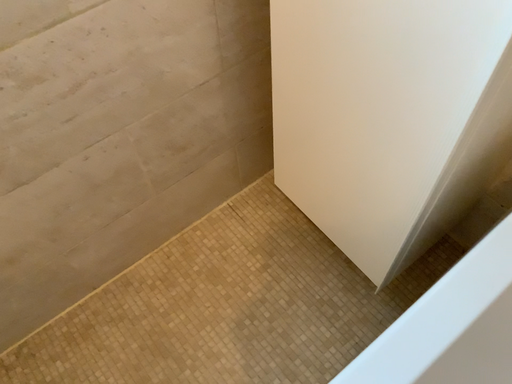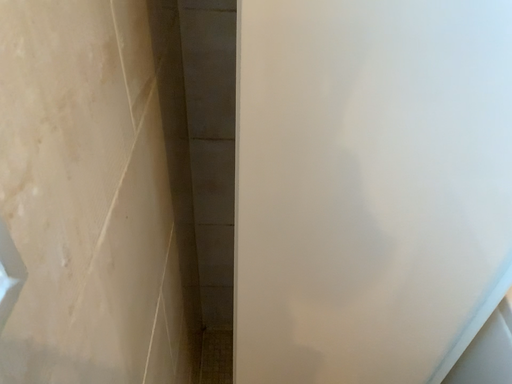
Question: How did the camera likely rotate when shooting the video?

Choices:
 (A) rotated left
 (B) rotated right

Answer: (B)